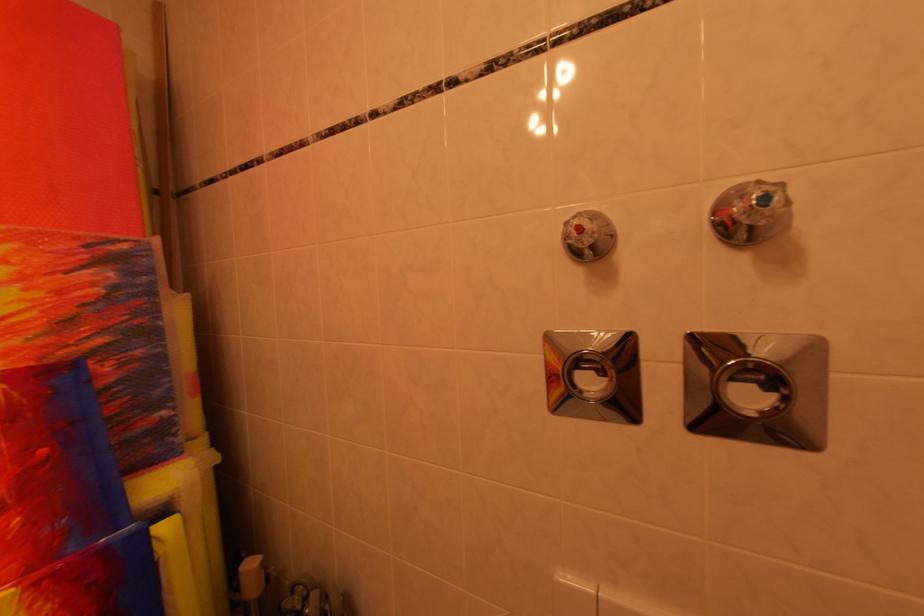
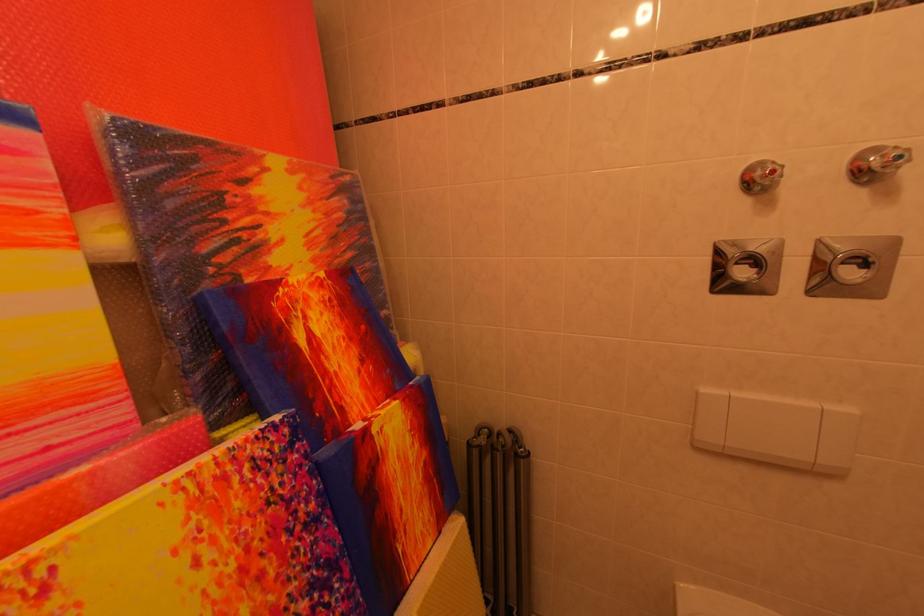
The point at (x=761, y=390) is marked in the first image. Where is the corresponding point in the second image?

(864, 270)